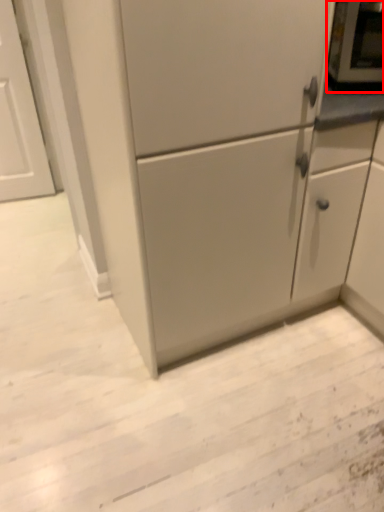
Question: Observing the image, what is the correct spatial positioning of appliance (annotated by the red box) in reference to cabinetry?

Choices:
 (A) left
 (B) right

Answer: (B)